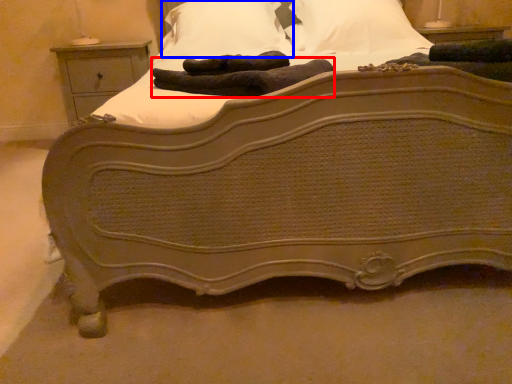
Question: Which object is closer to the camera taking this photo, material (highlighted by a red box) or pillow (highlighted by a blue box)?

Choices:
 (A) material
 (B) pillow

Answer: (A)